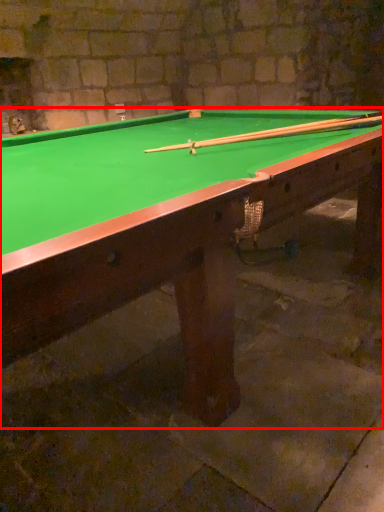
Question: Observing the image, what is the correct spatial positioning of billiard table (annotated by the red box) in reference to cue?

Choices:
 (A) left
 (B) right

Answer: (A)